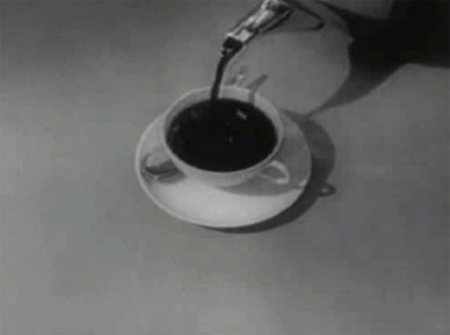
I want to click on dish, so click(246, 212).